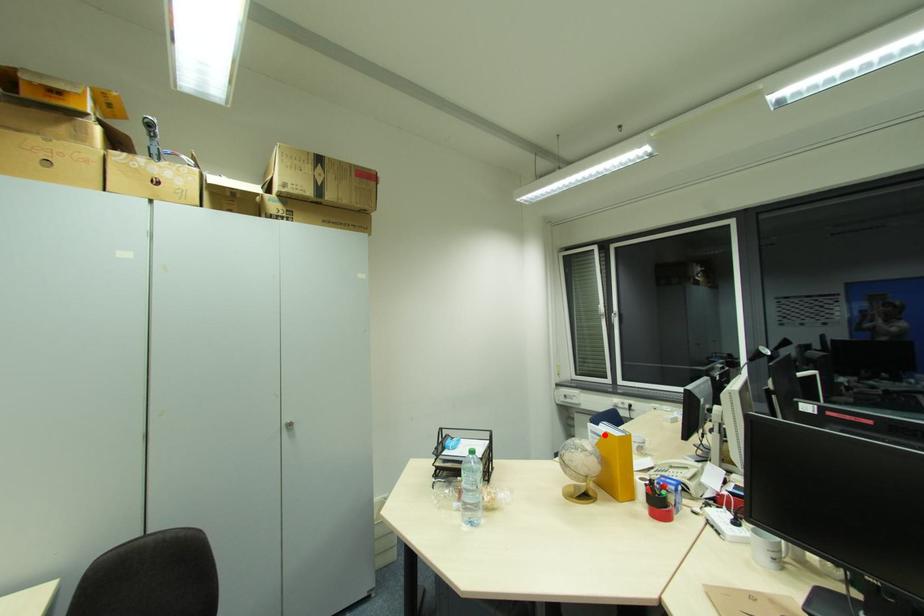
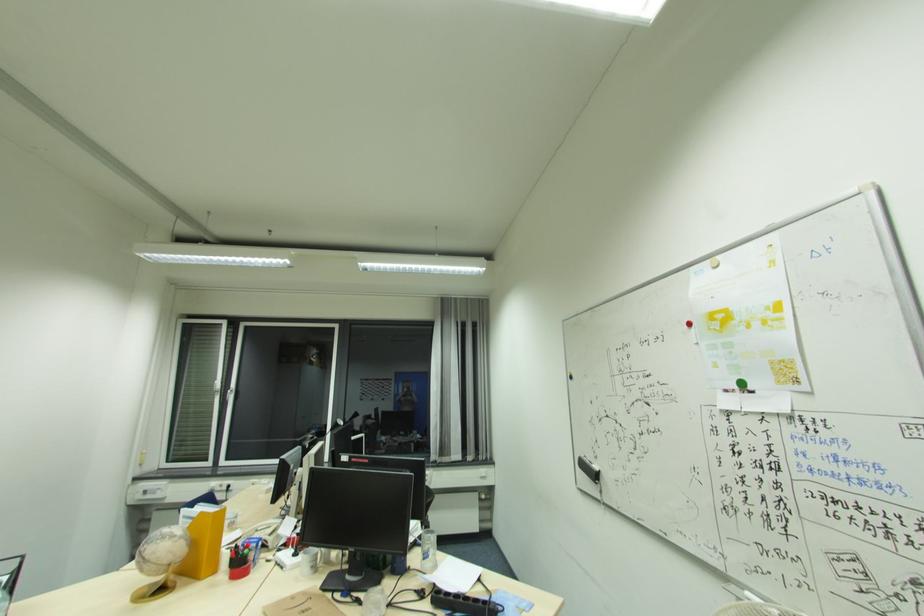
Find the pixel in the second image that matches the highlighted location in the first image.

(198, 517)